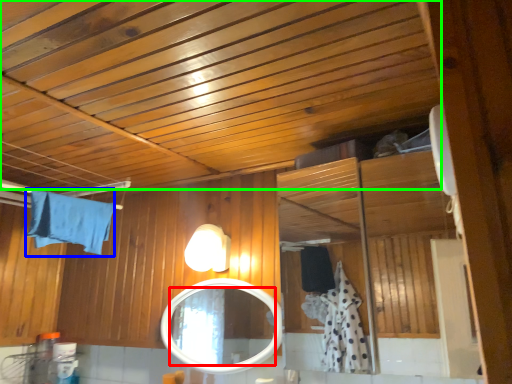
Question: Based on their relative distances, which object is nearer to mirror (highlighted by a red box)? Choose from bath towel (highlighted by a blue box) and exhaust hood (highlighted by a green box).

Choices:
 (A) bath towel
 (B) exhaust hood

Answer: (A)